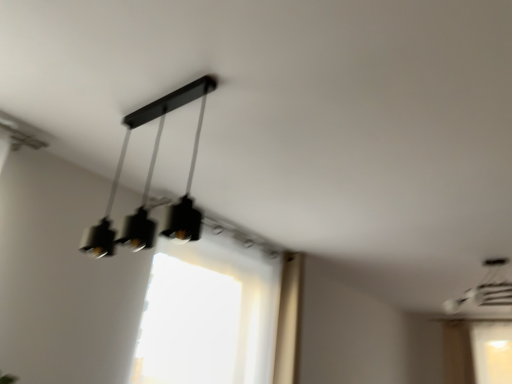
Question: Looking at their shapes, would you say matte black chandelier at upper right, marked as the second lamp in a top-to-bottom arrangement, is wider or thinner than matte black pendant light at upper center, which is counted as the first lamp, starting from the top?

Choices:
 (A) thin
 (B) wide

Answer: (A)

Question: Based on their positions, is matte black chandelier at upper right, the 2th lamp in the front-to-back sequence, located to the left or right of matte black pendant light at upper center, placed as the 2th lamp when sorted from right to left?

Choices:
 (A) right
 (B) left

Answer: (A)

Question: Based on their relative distances, which object is nearer to the matte black chandelier at upper right, which ranks as the first lamp in right-to-left order?

Choices:
 (A) transparent fabric window at center
 (B) matte black pendant light at upper center, which is the 2th lamp in back-to-front order

Answer: (A)

Question: Estimate the real-world distances between objects in this image. Which object is closer to the transparent fabric window at center?

Choices:
 (A) matte black pendant light at upper center, marked as the 1th lamp in a left-to-right arrangement
 (B) matte black chandelier at upper right, the first lamp when ordered from back to front

Answer: (A)